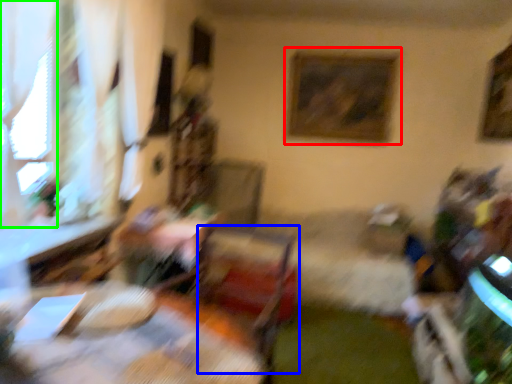
Question: Considering the real-world distances, which object is closest to picture frame (highlighted by a red box)? swivel chair (highlighted by a blue box) or window (highlighted by a green box).

Choices:
 (A) swivel chair
 (B) window

Answer: (A)